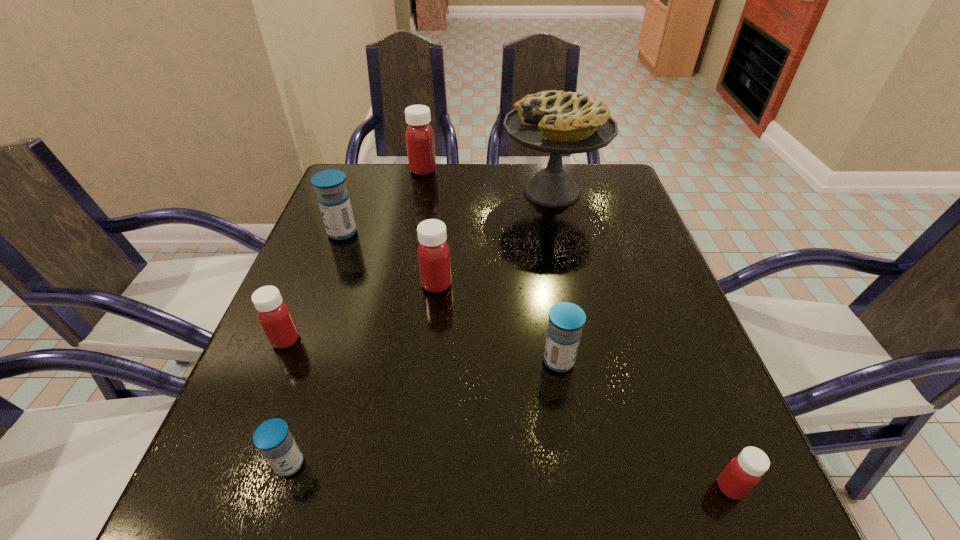
Where is `free space located 0.130m on the front of the second nearest red medicine`? Image resolution: width=960 pixels, height=540 pixels. free space located 0.130m on the front of the second nearest red medicine is located at coordinates (254, 416).

Locate an element on the screen. Image resolution: width=960 pixels, height=540 pixels. vacant space located 0.140m on the front of the second nearest blue medicine is located at coordinates (573, 453).

I want to click on free location located on the back of the smallest blue medicine, so click(x=314, y=387).

The height and width of the screenshot is (540, 960). I want to click on free space located on the left of the nearest red medicine, so click(667, 488).

Image resolution: width=960 pixels, height=540 pixels. Find the location of `pie at the far edge`. pie at the far edge is located at coordinates (557, 122).

You are a GUI agent. You are given a task and a screenshot of the screen. Output one action in this format:
    pyautogui.click(x=<x>, y=<y>)
    Task: Click on the medicine that is at the far edge
    The width and height of the screenshot is (960, 540).
    Given the screenshot: What is the action you would take?
    pyautogui.click(x=419, y=135)

Locate an element on the screen. The image size is (960, 540). pie situated at the right edge is located at coordinates (557, 122).

You are a GUI agent. You are given a task and a screenshot of the screen. Output one action in this format:
    pyautogui.click(x=<x>, y=<y>)
    Task: Click on the medicine located at the right edge
    This screenshot has height=540, width=960.
    Given the screenshot: What is the action you would take?
    pyautogui.click(x=744, y=472)

Where is `object positioned at the near left corner`? The image size is (960, 540). object positioned at the near left corner is located at coordinates (272, 437).

Locate an element on the screen. The image size is (960, 540). object that is at the far right corner is located at coordinates (557, 122).